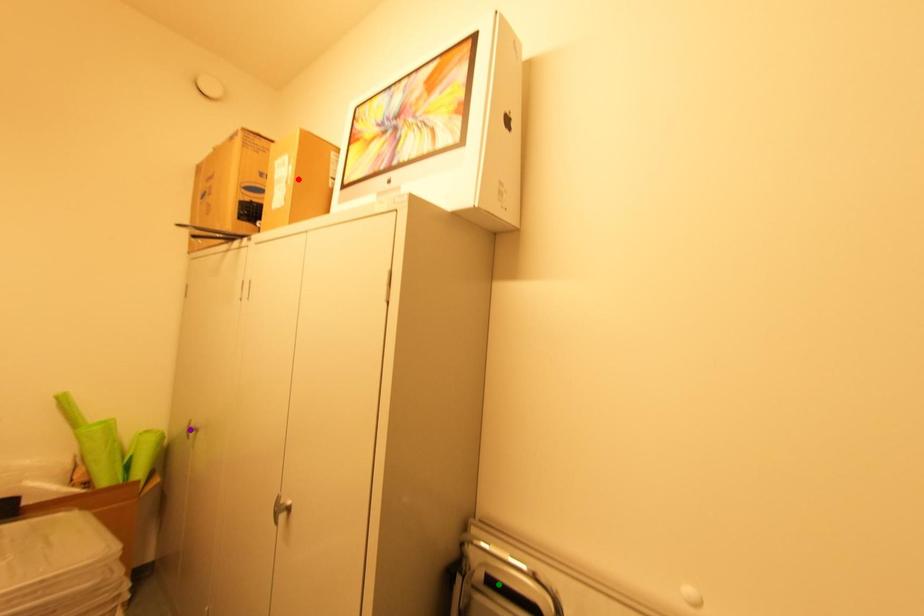
Based on the photo, order these from farthest to nearest:
1. red point
2. purple point
3. green point

purple point < red point < green point